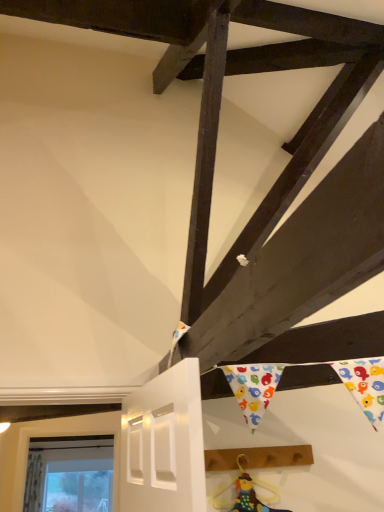
Question: In terms of width, does brown wooden plank at lower right look wider or thinner when compared to multicolored fabric doll at lower center?

Choices:
 (A) thin
 (B) wide

Answer: (B)

Question: In the image, is brown wooden plank at lower right positioned in front of or behind multicolored fabric doll at lower center?

Choices:
 (A) behind
 (B) front

Answer: (A)

Question: From the image's perspective, is brown wooden plank at lower right positioned above or below multicolored fabric doll at lower center?

Choices:
 (A) below
 (B) above

Answer: (B)

Question: Looking at the image, does multicolored fabric doll at lower center seem bigger or smaller compared to brown wooden plank at lower right?

Choices:
 (A) small
 (B) big

Answer: (A)

Question: Does point (238, 501) appear closer or farther from the camera than point (254, 450)?

Choices:
 (A) closer
 (B) farther

Answer: (A)

Question: Is multicolored fabric doll at lower center in front of or behind brown wooden plank at lower right in the image?

Choices:
 (A) front
 (B) behind

Answer: (A)

Question: From the image's perspective, is multicolored fabric doll at lower center positioned above or below brown wooden plank at lower right?

Choices:
 (A) below
 (B) above

Answer: (A)